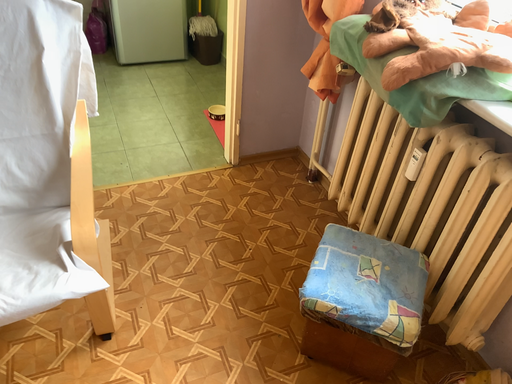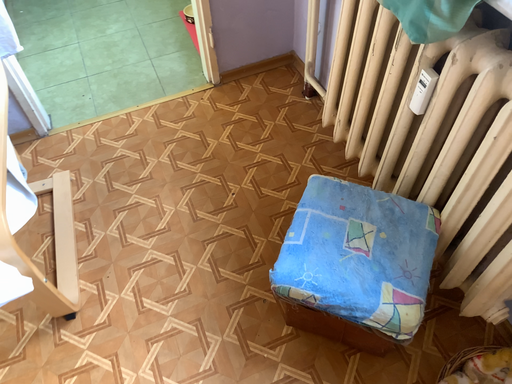
Question: How did the camera likely rotate when shooting the video?

Choices:
 (A) rotated upward
 (B) rotated downward

Answer: (B)